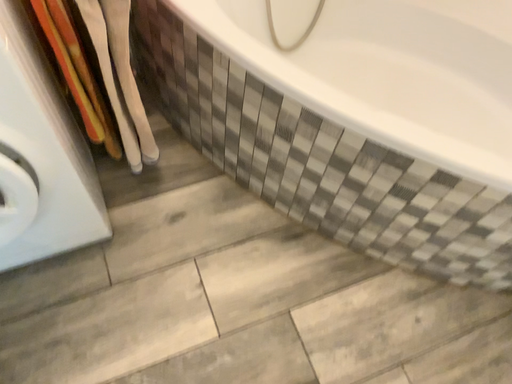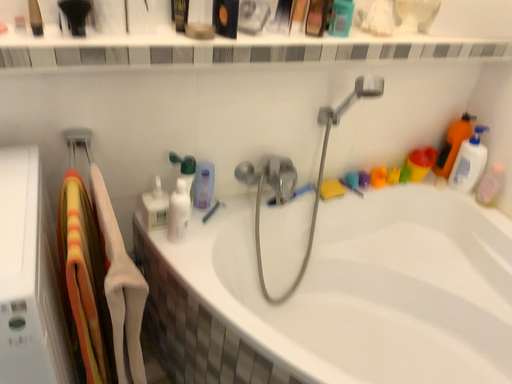
Question: Which way did the camera rotate in the video?

Choices:
 (A) rotated upward
 (B) rotated downward

Answer: (A)